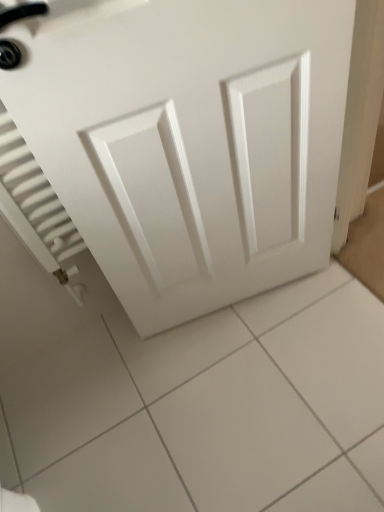
You are a GUI agent. You are given a task and a screenshot of the screen. Output one action in this format:
    pyautogui.click(x=<x>, y=<y>)
    Task: Click on the blank space situated above white ceramic tile at center (from a real-world perspective)
    The width and height of the screenshot is (384, 512).
    Given the screenshot: What is the action you would take?
    pyautogui.click(x=213, y=393)